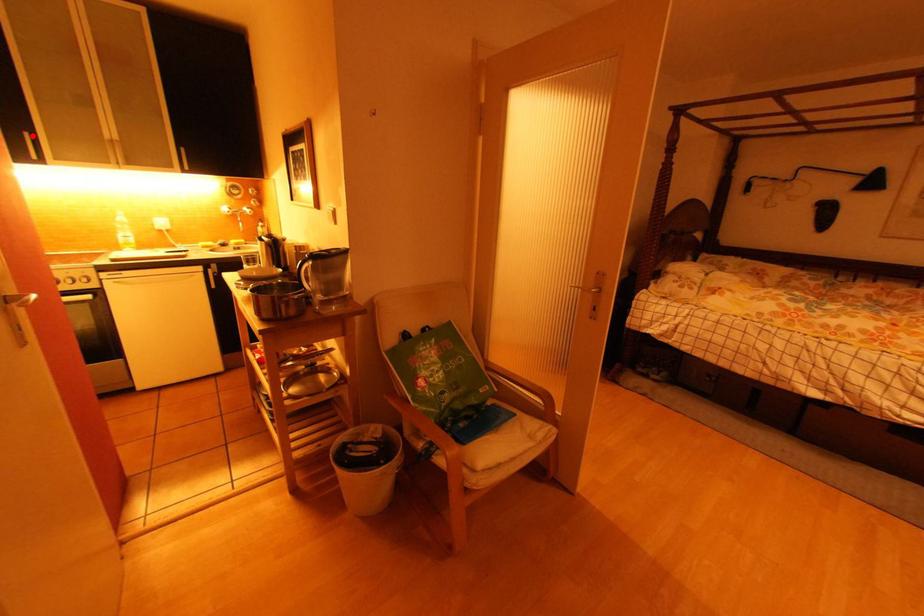
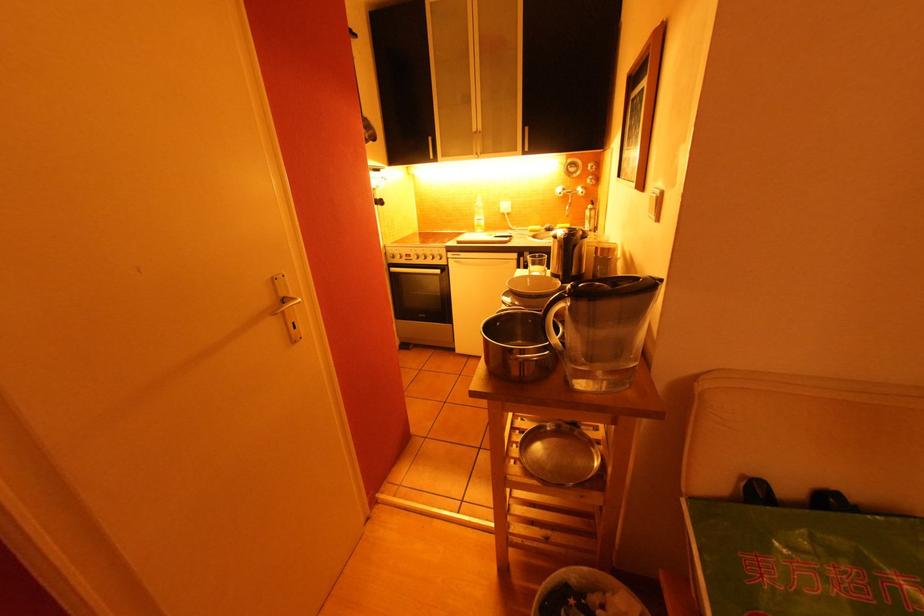
Question: I am providing you with two images of the same scene from different viewpoints. Given a red point in image1, look at the same physical point in image2. Is it:

Choices:
 (A) Closer to the viewpoint
 (B) Farther from the viewpoint

Answer: (A)